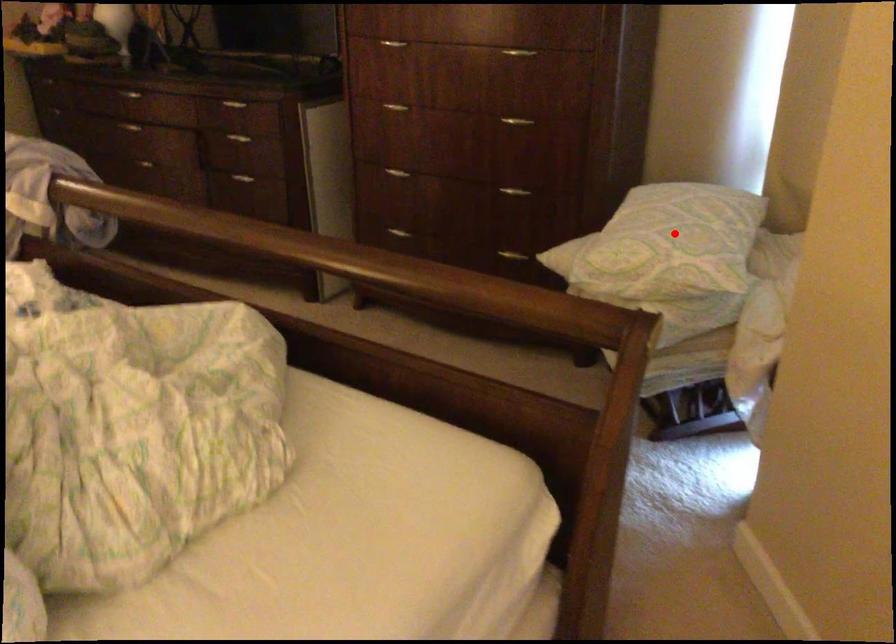
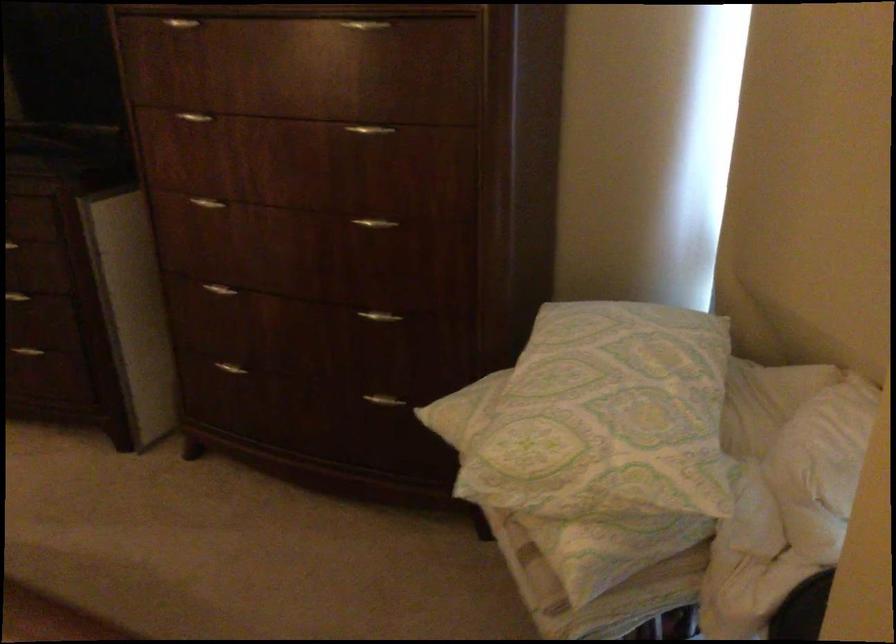
In the second image, find the point that corresponds to the highlighted location in the first image.

(607, 415)